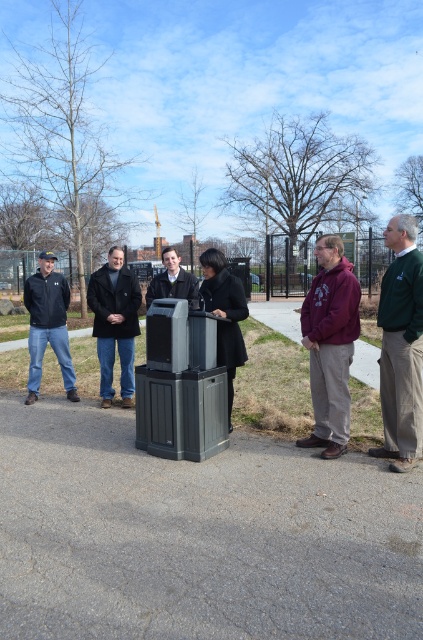
Which of these two, dark blue wool coat at center or matte black jacket at left, stands shorter?

matte black jacket at left

Can you confirm if dark blue wool coat at center is positioned to the left of matte black jacket at left?

Incorrect, dark blue wool coat at center is not on the left side of matte black jacket at left.

At what (x,y) coordinates should I click in order to perform the action: click on dark blue wool coat at center. Please return your answer as a coordinate pair (x, y). This screenshot has height=640, width=423. Looking at the image, I should click on (115, 323).

This screenshot has height=640, width=423. Find the location of `green fleece jacket at right`. green fleece jacket at right is located at coordinates (401, 346).

Is green fleece jacket at right positioned at the back of dark gray plastic trash can at center?

No, green fleece jacket at right is in front of dark gray plastic trash can at center.

What do you see at coordinates (401, 346) in the screenshot? I see `green fleece jacket at right` at bounding box center [401, 346].

You are a GUI agent. You are given a task and a screenshot of the screen. Output one action in this format:
    pyautogui.click(x=<x>, y=<y>)
    Task: Click on the green fleece jacket at right
    This screenshot has height=640, width=423.
    Given the screenshot: What is the action you would take?
    pyautogui.click(x=401, y=346)

Is green fleece jacket at right wider than dark blue wool coat at center?

Incorrect, green fleece jacket at right's width does not surpass dark blue wool coat at center's.

From the picture: Can you confirm if green fleece jacket at right is positioned below dark blue wool coat at center?

Indeed, green fleece jacket at right is positioned under dark blue wool coat at center.

Where is `green fleece jacket at right`? The width and height of the screenshot is (423, 640). green fleece jacket at right is located at coordinates (401, 346).